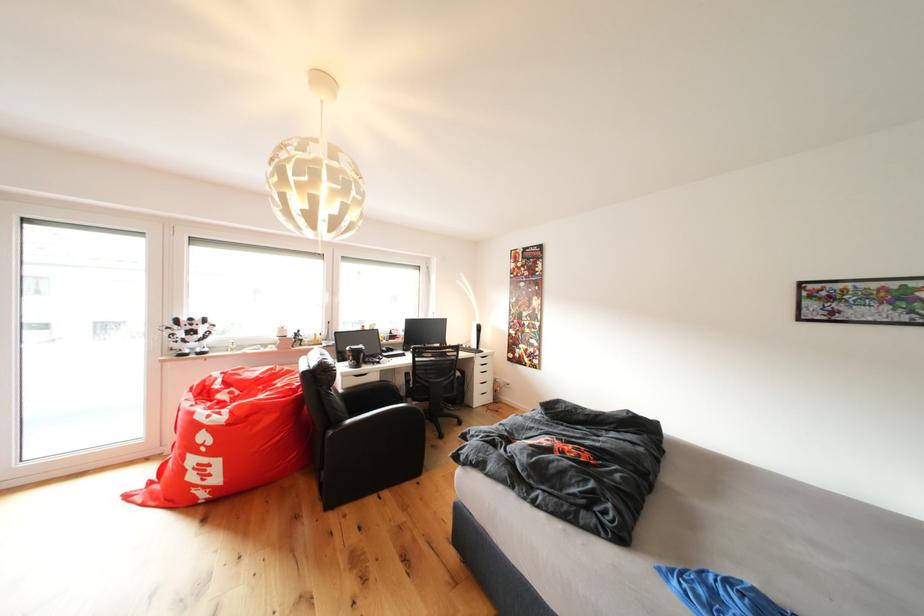
Locate an element on the screen. This screenshot has width=924, height=616. black tumbler cup is located at coordinates [355, 355].